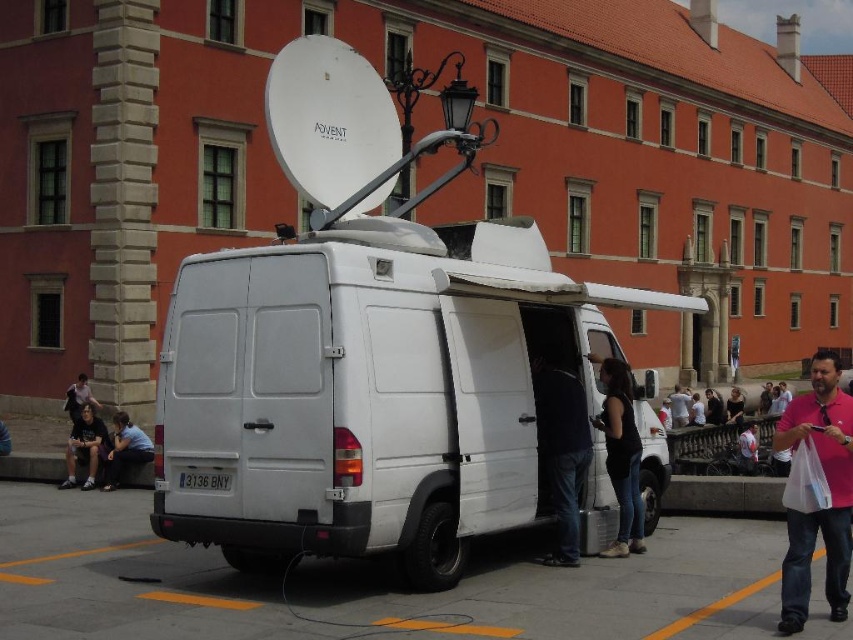
Is black fabric pants at lower center wider than dark blue jeans at lower left?

Yes, black fabric pants at lower center is wider than dark blue jeans at lower left.

Does black fabric pants at lower center have a larger size compared to dark blue jeans at lower left?

Yes.

Is point (577, 538) positioned in front of point (79, 460)?

That is True.

Where is `black fabric pants at lower center`? Image resolution: width=853 pixels, height=640 pixels. black fabric pants at lower center is located at coordinates (561, 445).

Can you confirm if white matte van at center is shorter than dark hair at lower center?

In fact, white matte van at center may be taller than dark hair at lower center.

Does point (515, 509) come closer to viewer compared to point (720, 396)?

That is True.

This screenshot has height=640, width=853. I want to click on white matte van at center, so click(368, 392).

Find the location of a particular element. This screenshot has height=640, width=853. pink fabric shirt at right is located at coordinates (828, 488).

Is pink fabric shirt at right further to the viewer compared to dark blue jeans at lower left?

No, it is in front of dark blue jeans at lower left.

This screenshot has width=853, height=640. Find the location of `pink fabric shirt at right`. pink fabric shirt at right is located at coordinates (828, 488).

At what (x,y) coordinates should I click in order to perform the action: click on pink fabric shirt at right. Please return your answer as a coordinate pair (x, y). The width and height of the screenshot is (853, 640). Looking at the image, I should click on (828, 488).